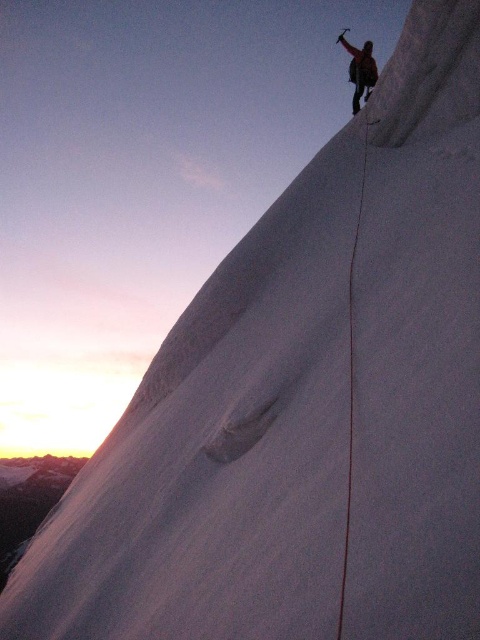
Question: Does smooth ice crack at upper right have a lesser width compared to dark brown leather jacket at upper right?

Choices:
 (A) no
 (B) yes

Answer: (A)

Question: Which object appears farthest from the camera in this image?

Choices:
 (A) smooth ice crack at upper right
 (B) dark brown leather jacket at upper right

Answer: (B)

Question: Does smooth ice crack at upper right appear under dark brown leather jacket at upper right?

Choices:
 (A) no
 (B) yes

Answer: (B)

Question: Can you confirm if smooth ice crack at upper right is positioned to the right of dark brown leather jacket at upper right?

Choices:
 (A) no
 (B) yes

Answer: (A)